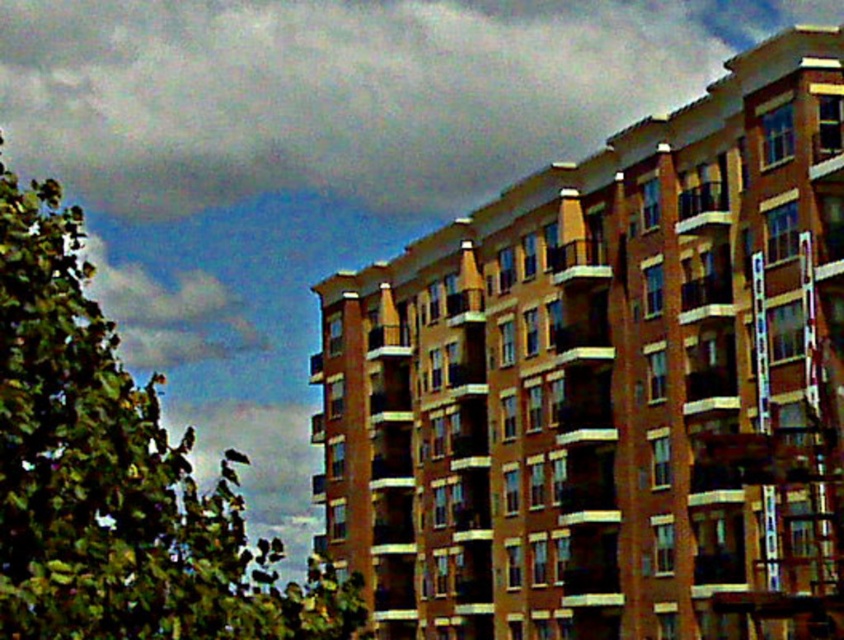
You are standing in front of the residential building and notice the green leafy tree at left and the white fluffy cloud at upper left. Which object is nearer to you?

The green leafy tree at left is closer to the viewer than the white fluffy cloud at upper left.

You are standing in front of the residential building and notice two points marked on the facade. The first point is at coordinate point (x=14, y=593) and the second is at point (x=191, y=288). Which point is closer to you?

Point (x=14, y=593) is closer to the camera than point (x=191, y=288).

You are standing in front of the residential building and notice the gray fluffy cloud at upper left and the green leafy tree at left. Which object appears closer to the sky in the image?

The gray fluffy cloud at upper left is shorter than the green leafy tree at left, so the green leafy tree at left appears closer to the sky in the image.